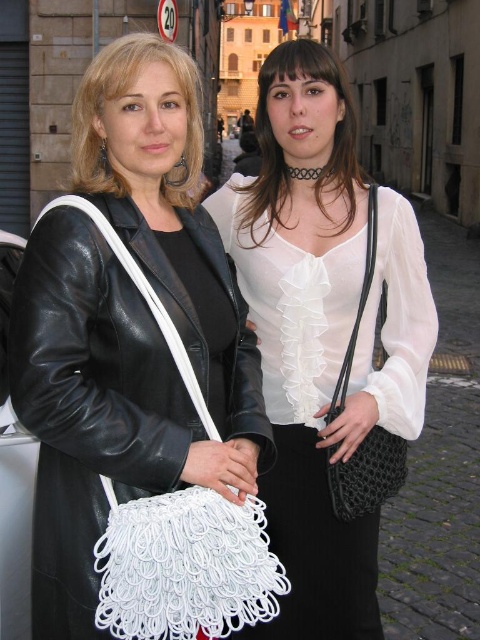
Is white mesh bag at center thinner than matte black jacket at center?

Correct, white mesh bag at center's width is less than matte black jacket at center's.

Between white mesh bag at center and matte black jacket at center, which one has less height?

With less height is matte black jacket at center.

What do you see at coordinates (324, 333) in the screenshot? The height and width of the screenshot is (640, 480). I see `white mesh bag at center` at bounding box center [324, 333].

Where is `white mesh bag at center`? The width and height of the screenshot is (480, 640). white mesh bag at center is located at coordinates (324, 333).

Who is lower down, white woven bag at center or white mesh bag at center?

Positioned lower is white woven bag at center.

Is point (155, 218) behind point (324, 508)?

No.

Image resolution: width=480 pixels, height=640 pixels. In order to click on white woven bag at center in this screenshot , I will do `click(128, 330)`.

Find the location of a particular element. The image size is (480, 640). white woven bag at center is located at coordinates tap(128, 330).

Can you confirm if matte black jacket at center is wider than white sheer blouse at center?

Indeed, matte black jacket at center has a greater width compared to white sheer blouse at center.

Can you confirm if matte black jacket at center is positioned to the right of white sheer blouse at center?

In fact, matte black jacket at center is to the left of white sheer blouse at center.

Is point (97, 157) closer to viewer compared to point (251, 198)?

Yes, it is.

Locate an element on the screen. This screenshot has width=480, height=640. matte black jacket at center is located at coordinates (120, 97).